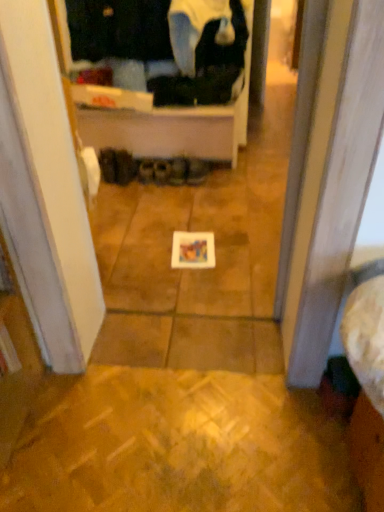
Find the location of a particular element. Image resolution: width=384 pixels, height=512 pixels. free space in front of matte black shoes at center, the second footwear from the right is located at coordinates (183, 192).